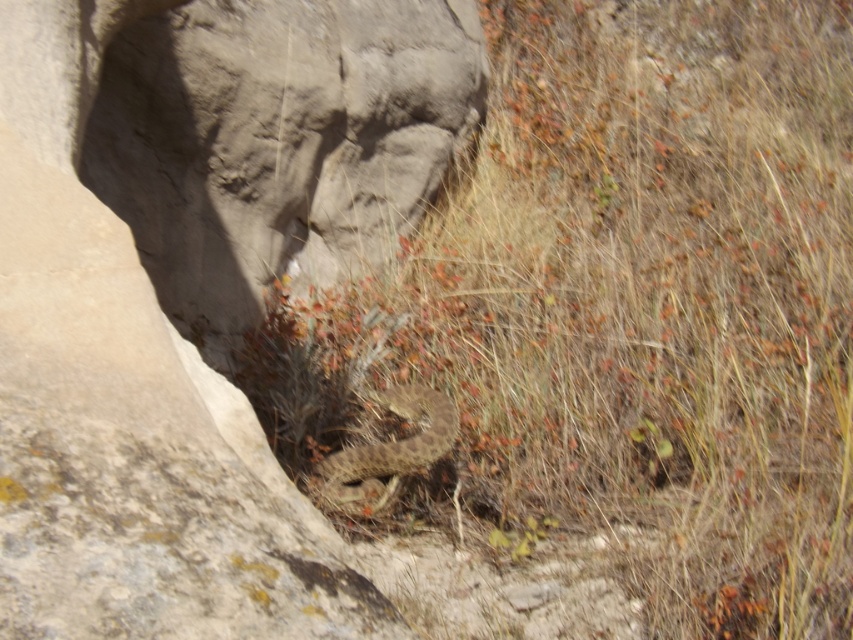
Question: Can you confirm if brown dry grass at center is wider than brown scaly snake at center?

Choices:
 (A) no
 (B) yes

Answer: (B)

Question: Does brown dry grass at center have a smaller size compared to brown scaly snake at center?

Choices:
 (A) yes
 (B) no

Answer: (B)

Question: Which point is closer to the camera?

Choices:
 (A) brown dry grass at center
 (B) brown scaly snake at center

Answer: (A)

Question: Can you confirm if brown dry grass at center is smaller than brown scaly snake at center?

Choices:
 (A) no
 (B) yes

Answer: (A)